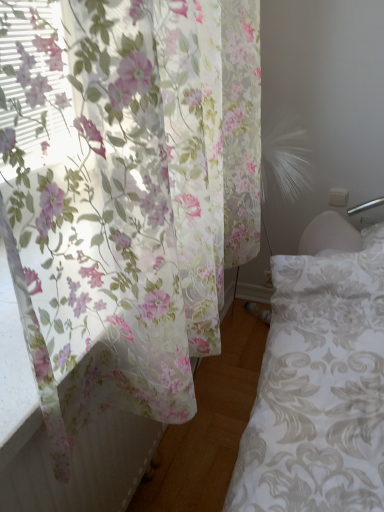
Question: Would you say translucent floral curtain at left is to the left or to the right of white damask fabric bed frame at lower right in the picture?

Choices:
 (A) left
 (B) right

Answer: (A)

Question: Is point (130, 179) positioned closer to the camera than point (235, 471)?

Choices:
 (A) closer
 (B) farther

Answer: (A)

Question: Based on their sizes in the image, would you say translucent floral curtain at left is bigger or smaller than white damask fabric bed frame at lower right?

Choices:
 (A) small
 (B) big

Answer: (B)

Question: Based on their positions, is white damask fabric bed frame at lower right located to the left or right of translucent floral curtain at left?

Choices:
 (A) left
 (B) right

Answer: (B)

Question: Is white damask fabric bed frame at lower right taller or shorter than translucent floral curtain at left?

Choices:
 (A) short
 (B) tall

Answer: (A)

Question: From the image's perspective, relative to translucent floral curtain at left, is white damask fabric bed frame at lower right above or below?

Choices:
 (A) above
 (B) below

Answer: (B)

Question: From a real-world perspective, is white damask fabric bed frame at lower right above or below translucent floral curtain at left?

Choices:
 (A) below
 (B) above

Answer: (A)